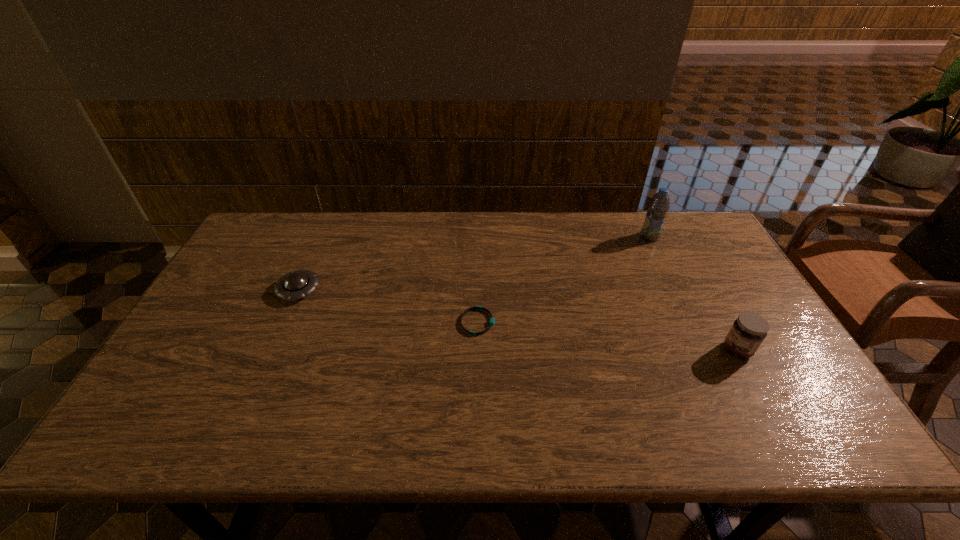
Find the location of `vacant space that's between the third object from left to right and the leftmost object`. vacant space that's between the third object from left to right and the leftmost object is located at coordinates (474, 264).

I want to click on free spot between the water bottle and the third shortest object, so click(x=693, y=293).

I want to click on free space between the shortest object and the second shortest object, so click(x=388, y=306).

Identify which object is the third nearest to the tallest object. Please provide its 2D coordinates. Your answer should be formatted as a tuple, i.e. [(x, y)], where the tuple contains the x and y coordinates of a point satisfying the conditions above.

[(297, 284)]

Identify which object is the nearest to the saucer. Please provide its 2D coordinates. Your answer should be formatted as a tuple, i.e. [(x, y)], where the tuple contains the x and y coordinates of a point satisfying the conditions above.

[(492, 320)]